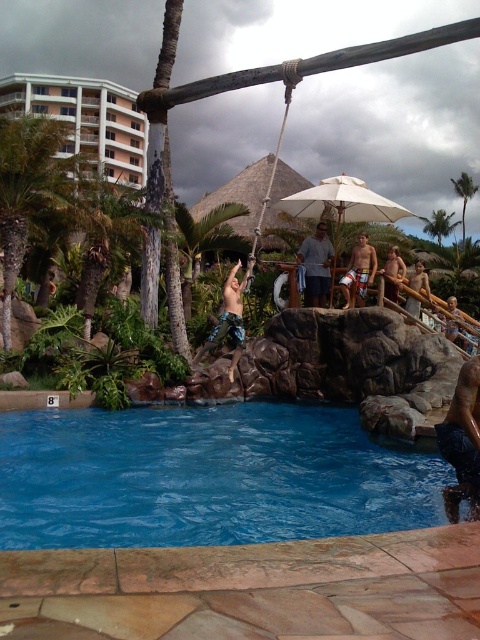
You are a photographer at the resort and want to capture a photo of the gray fabric shirt at upper center and the green leafy palm tree at upper center. Which object should you focus on first if you want to ensure both are in focus without adjusting the camera settings?

You should focus on the green leafy palm tree at upper center first because it is taller than the gray fabric shirt at upper center, so focusing on the taller object ensures both are in focus.

You are a photographer trying to capture a photo of the tan board shorts at upper right and the green leafy palm tree at upper center. Which object should you focus on first if you want to include both in your frame without moving the camera?

You should focus on the tan board shorts at upper right first because it is positioned to the left of the green leafy palm tree at upper center, so capturing it first ensures both objects are in the frame without needing to adjust the camera position.